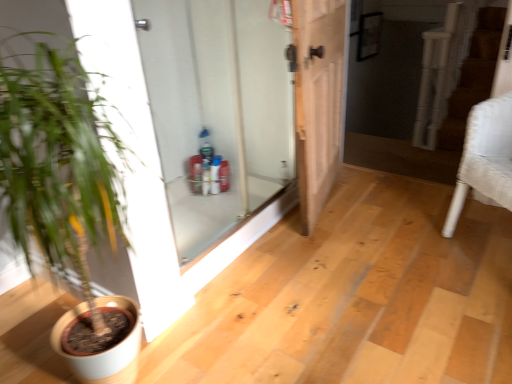
You are a GUI agent. You are given a task and a screenshot of the screen. Output one action in this format:
    pyautogui.click(x=<x>, y=<y>)
    Task: Click on the vacant area that lies between white textured armchair at right and light brown wooden door at center, arranged as the 2th door when viewed from the left
    The image size is (512, 384).
    Given the screenshot: What is the action you would take?
    pyautogui.click(x=394, y=226)